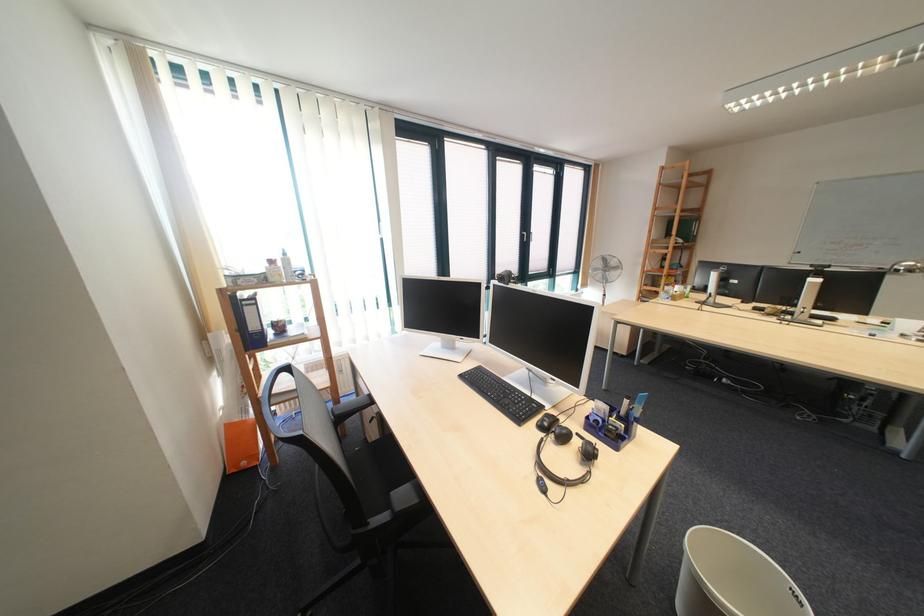
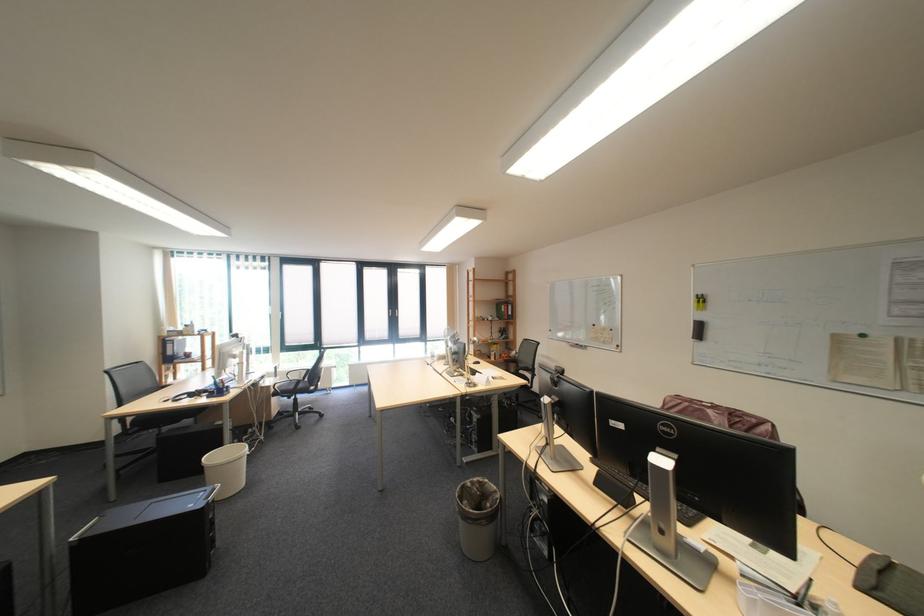
Question: Which direction would the cameraman need to move to produce the second image? Reply with the corresponding letter.

Choices:
 (A) Left
 (B) Right
 (C) Forward
 (D) Backward

Answer: (B)